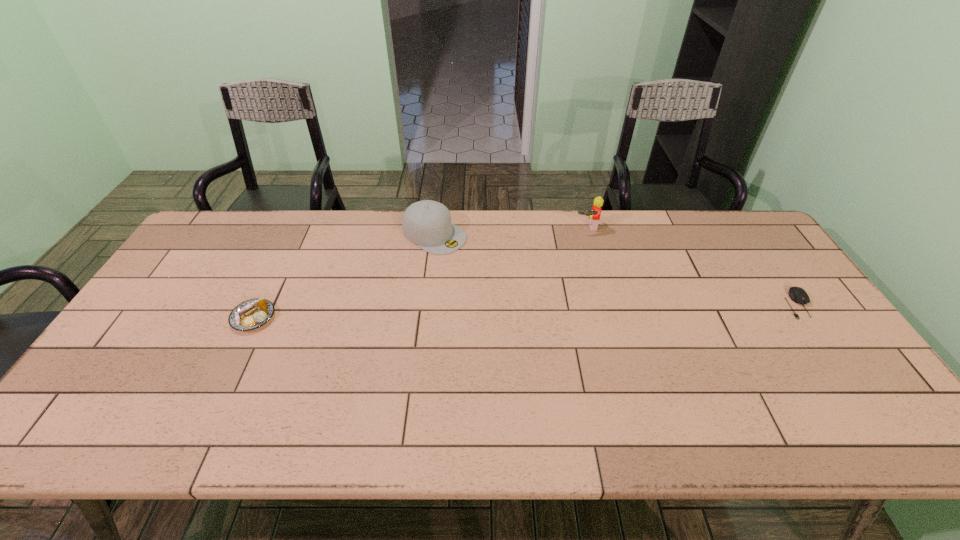
Identify the location of the leftmost object. The image size is (960, 540). (249, 315).

I want to click on the second shortest object, so click(x=249, y=315).

The width and height of the screenshot is (960, 540). Find the location of `the shortest object`. the shortest object is located at coordinates (798, 295).

Find the location of `the rightmost object`. the rightmost object is located at coordinates (798, 295).

Find the location of a particular element. the tallest object is located at coordinates [x=594, y=214].

Locate an element on the screen. Lego is located at coordinates (594, 214).

Image resolution: width=960 pixels, height=540 pixels. Identify the location of cap. (427, 223).

Identify the location of the second object from left to right. (427, 223).

You are a GUI agent. You are given a task and a screenshot of the screen. Output one action in this format:
    pyautogui.click(x=<x>, y=<y>)
    Task: Click on the blank area located 0.090m on the front of the leftmost object
    Image resolution: width=960 pixels, height=540 pixels.
    Given the screenshot: What is the action you would take?
    pyautogui.click(x=231, y=362)

Image resolution: width=960 pixels, height=540 pixels. Identify the location of vacant space located on the front of the rightmost object. (838, 362).